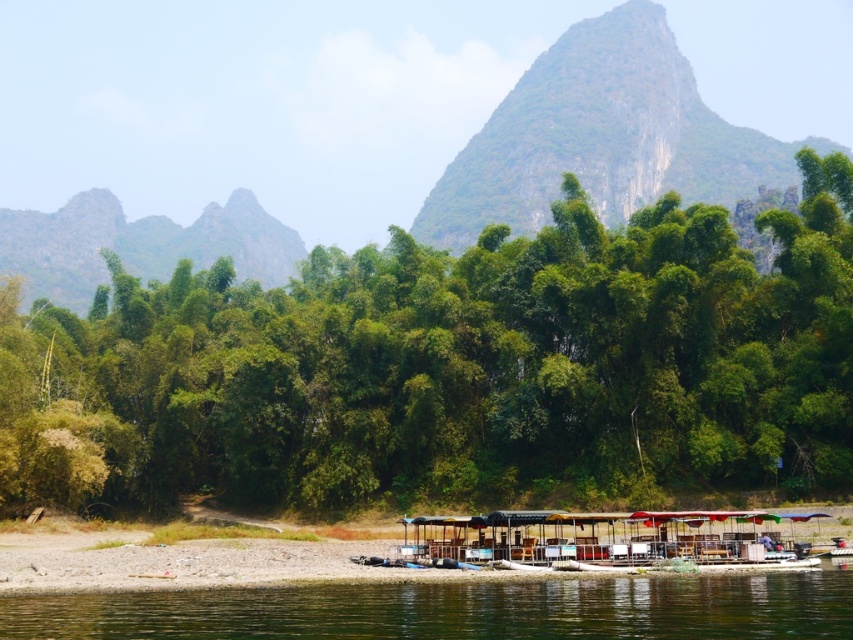
Question: Observing the image, what is the correct spatial positioning of wooden raft at lower center in reference to rocky gray mountain at upper left?

Choices:
 (A) left
 (B) right

Answer: (B)

Question: In this image, where is green leafy mountain at upper center located relative to clear water at lower center?

Choices:
 (A) left
 (B) right

Answer: (B)

Question: Can you confirm if green leafy trees at center is bigger than wooden raft at lower center?

Choices:
 (A) yes
 (B) no

Answer: (A)

Question: Estimate the real-world distances between objects in this image. Which object is farther from the wooden raft at lower center?

Choices:
 (A) green leafy mountain at upper center
 (B) rocky gray mountain at upper left
 (C) green leafy trees at center

Answer: (B)

Question: Which object appears closest to the camera in this image?

Choices:
 (A) wooden raft at lower center
 (B) green leafy mountain at upper center
 (C) rocky gray mountain at upper left

Answer: (A)

Question: Which object is closer to the camera taking this photo?

Choices:
 (A) green leafy mountain at upper center
 (B) green leafy trees at center
 (C) clear water at lower center

Answer: (C)